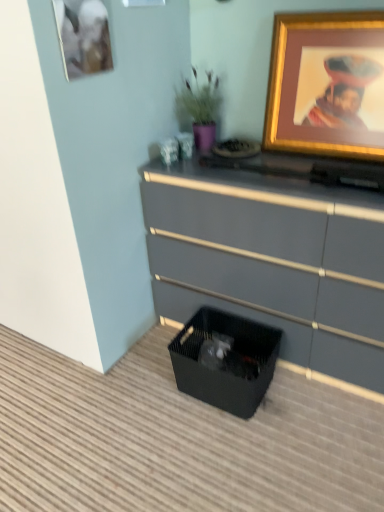
Question: Considering the positions of matte gray dresser at center and gold-framed picture at upper right, the first picture frame viewed from the right, in the image, is matte gray dresser at center bigger or smaller than gold-framed picture at upper right, the first picture frame viewed from the right,?

Choices:
 (A) small
 (B) big

Answer: (B)

Question: In the image, is matte gray dresser at center on the left side or the right side of gold-framed picture at upper right, the first picture frame viewed from the right?

Choices:
 (A) left
 (B) right

Answer: (A)

Question: Based on their relative distances, which object is nearer to the matte gold picture frame at upper left, placed as the 2th picture frame when sorted from right to left?

Choices:
 (A) purple matte vase at upper center
 (B) gold-framed picture at upper right, the first picture frame viewed from the right
 (C) black mesh storage box at lower center
 (D) matte gray dresser at center

Answer: (A)

Question: Estimate the real-world distances between objects in this image. Which object is farther from the black mesh storage box at lower center?

Choices:
 (A) gold-framed picture at upper right, the first picture frame viewed from the right
 (B) matte gray dresser at center
 (C) matte gold picture frame at upper left, placed as the 2th picture frame when sorted from right to left
 (D) purple matte vase at upper center

Answer: (C)